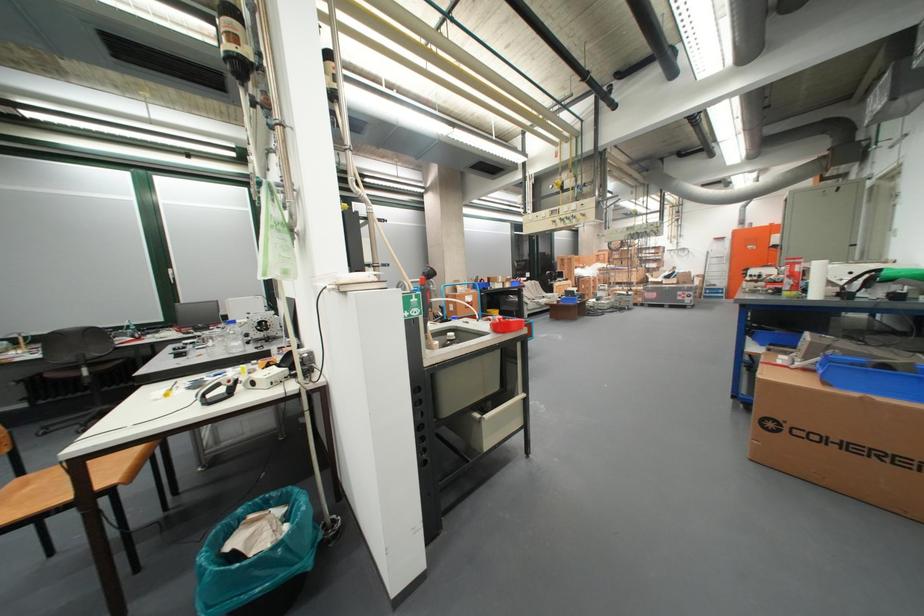
Which object does [839,438] point to?

It corresponds to the large cardboard box in the image.